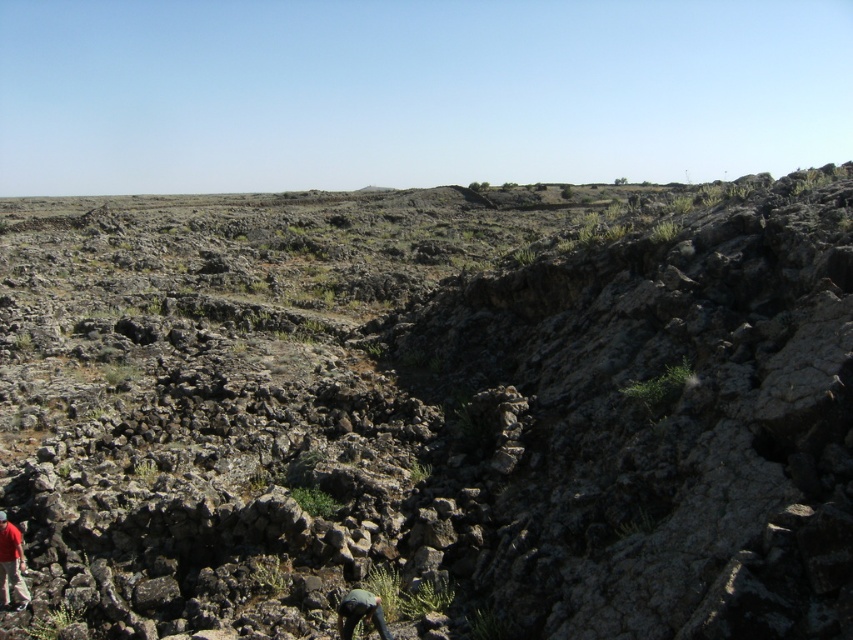
Does rocky terrain at center come in front of dark gray fabric at lower center?

Yes, it is.

Where is `rocky terrain at center`? This screenshot has width=853, height=640. rocky terrain at center is located at coordinates (433, 412).

In the scene shown: Is rocky terrain at center to the left of red fabric shirt at lower left from the viewer's perspective?

In fact, rocky terrain at center is to the right of red fabric shirt at lower left.

Is point (708, 625) positioned after point (22, 592)?

No.

The width and height of the screenshot is (853, 640). Find the location of `rocky terrain at center`. rocky terrain at center is located at coordinates (433, 412).

This screenshot has width=853, height=640. Describe the element at coordinates (10, 564) in the screenshot. I see `red fabric shirt at lower left` at that location.

Does point (16, 531) come closer to viewer compared to point (351, 628)?

No, (16, 531) is further to viewer.

Find the location of a particular element. Image resolution: width=853 pixels, height=640 pixels. red fabric shirt at lower left is located at coordinates pyautogui.click(x=10, y=564).